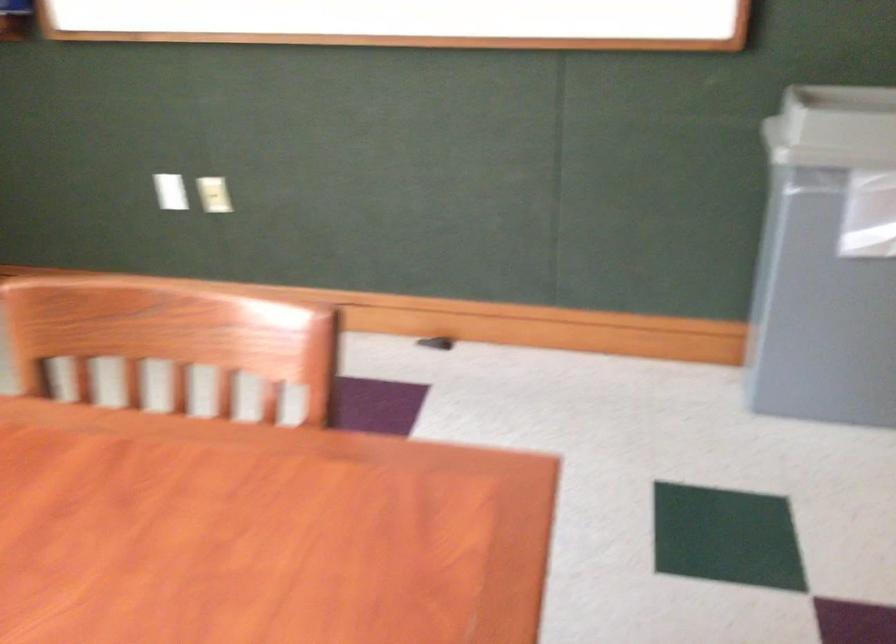
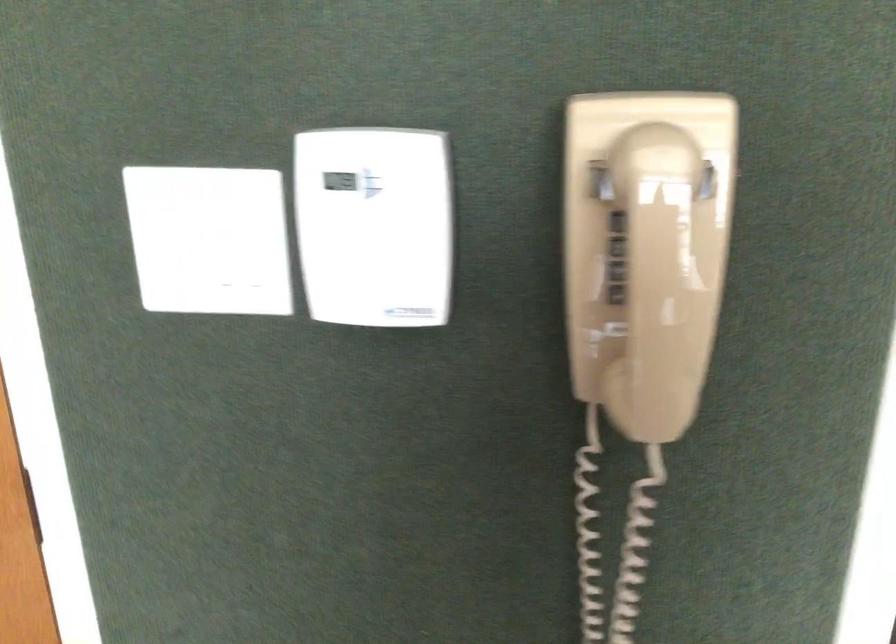
First-person continuous shooting, in which direction is the camera rotating?

The camera rotated toward right-down.